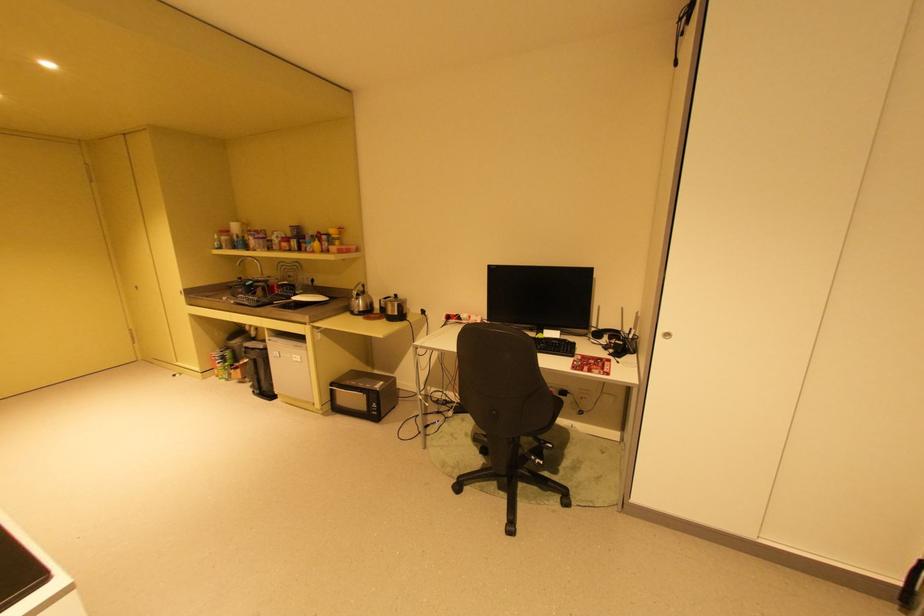
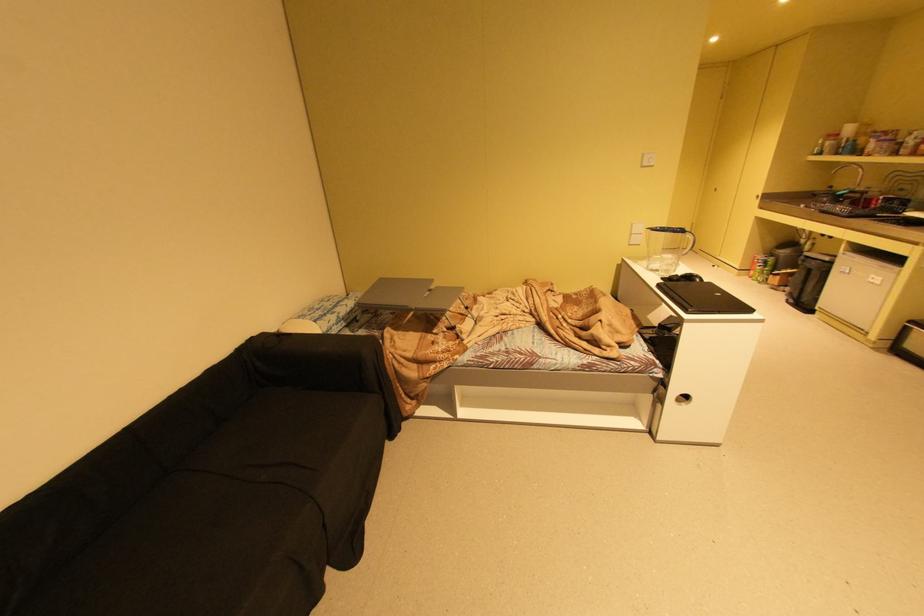
Locate, in the second image, the point that corresponds to point (261, 392) in the first image.

(796, 301)